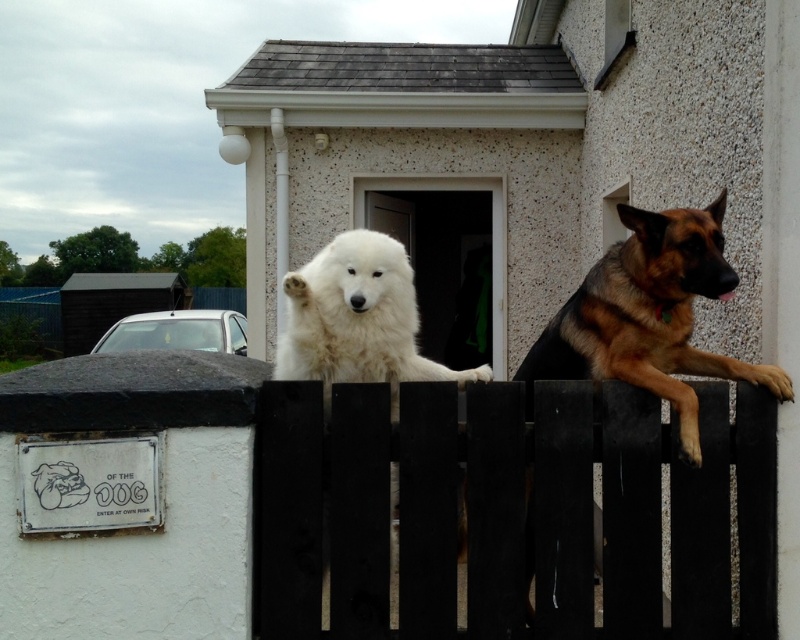
Question: Can you confirm if brown fur dog at right is positioned below white fluffy dog at center?

Choices:
 (A) yes
 (B) no

Answer: (A)

Question: Is black wooden fence at center positioned at the back of white fluffy dog at center?

Choices:
 (A) no
 (B) yes

Answer: (B)

Question: Which object appears closest to the camera in this image?

Choices:
 (A) black wooden fence at center
 (B) white fluffy dog at center

Answer: (B)

Question: Which object is positioned closest to the brown fur dog at right?

Choices:
 (A) black wooden fence at center
 (B) white fluffy dog at center

Answer: (A)

Question: Is brown fur dog at right to the right of white fluffy dog at center from the viewer's perspective?

Choices:
 (A) no
 (B) yes

Answer: (B)

Question: Which is farther from the white fluffy dog at center?

Choices:
 (A) black wooden fence at center
 (B) brown fur dog at right

Answer: (B)